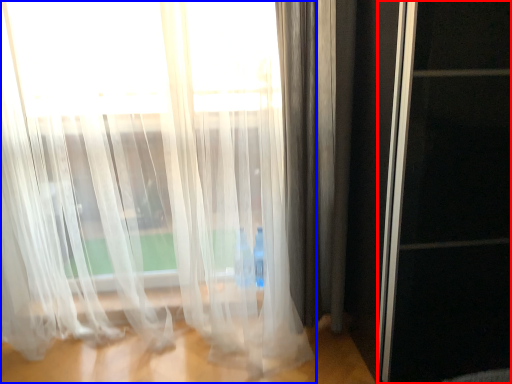
Question: Which object is closer to the camera taking this photo, screen door (highlighted by a red box) or curtain (highlighted by a blue box)?

Choices:
 (A) screen door
 (B) curtain

Answer: (A)